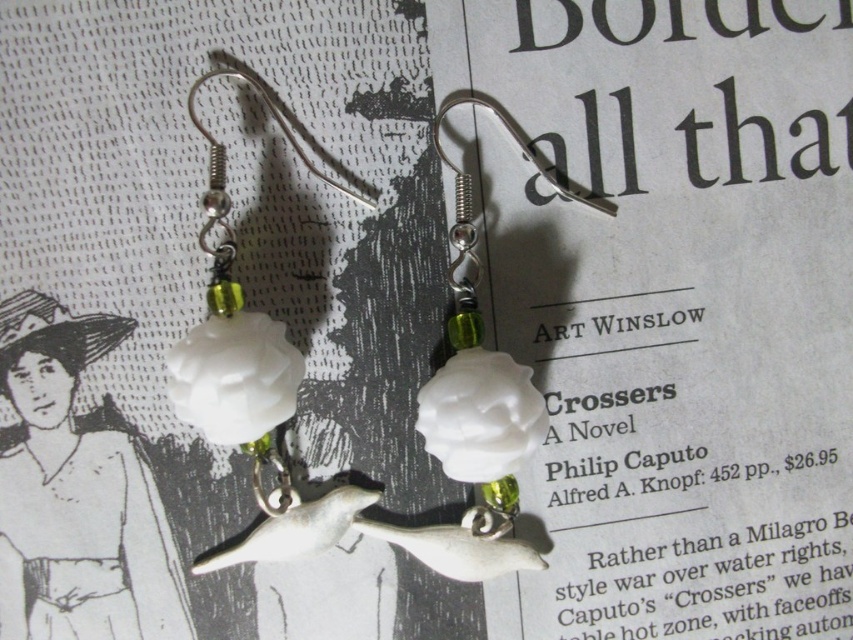
You are a photographer trying to capture the earrings in the image. You want to focus on the point that is closer to the camera. Which point should you choose between point (3,547) and point (398,538)?

Point (3,547) is closer to the camera than point (398,538), so you should choose point (3,547) to focus on.

Based on the photo, looking at the scene described, where is the matte white porcelain at center in relation to the white porcelain flower at center?

The matte white porcelain at center is to the left of the white porcelain flower at center.

You are an interior designer arranging a display on a table. You have two items to place next to each other on a shelf. The matte white porcelain at center and the white porcelain rose at center. Which item should you place first if you want to follow the size order from smallest to largest?

The matte white porcelain at center has a smaller size compared to the white porcelain rose at center, so you should place the matte white porcelain at center first to follow the size order from smallest to largest.